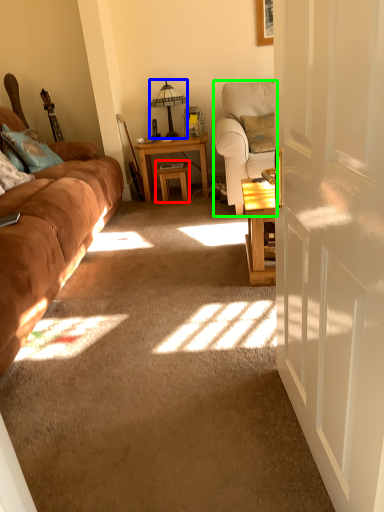
Question: Which object is the farthest from table (highlighted by a red box)? Choose among these: table lamp (highlighted by a blue box) or chair (highlighted by a green box).

Choices:
 (A) table lamp
 (B) chair

Answer: (B)